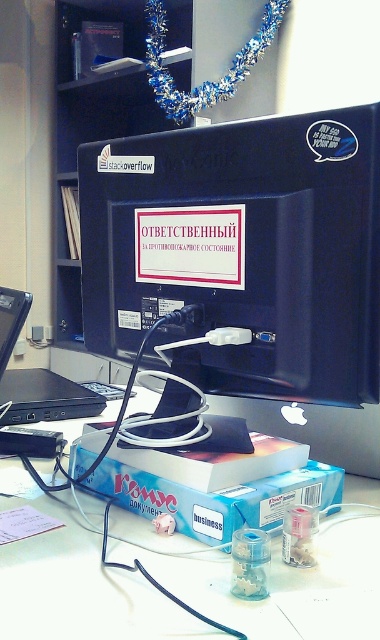
Which of these two, matte black monitor at center or white plastic computer desk at center, stands taller?

Standing taller between the two is matte black monitor at center.

Which is in front, point (346, 237) or point (6, 627)?

Positioned in front is point (6, 627).

I want to click on matte black monitor at center, so click(242, 248).

Find the location of a particular element. Image resolution: width=380 pixels, height=640 pixels. matte black monitor at center is located at coordinates (242, 248).